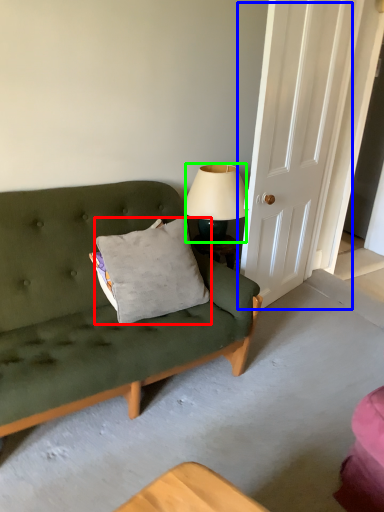
Question: Which object is the closest to the pillow (highlighted by a red box)? Choose among these: door (highlighted by a blue box) or lamp (highlighted by a green box).

Choices:
 (A) door
 (B) lamp

Answer: (B)